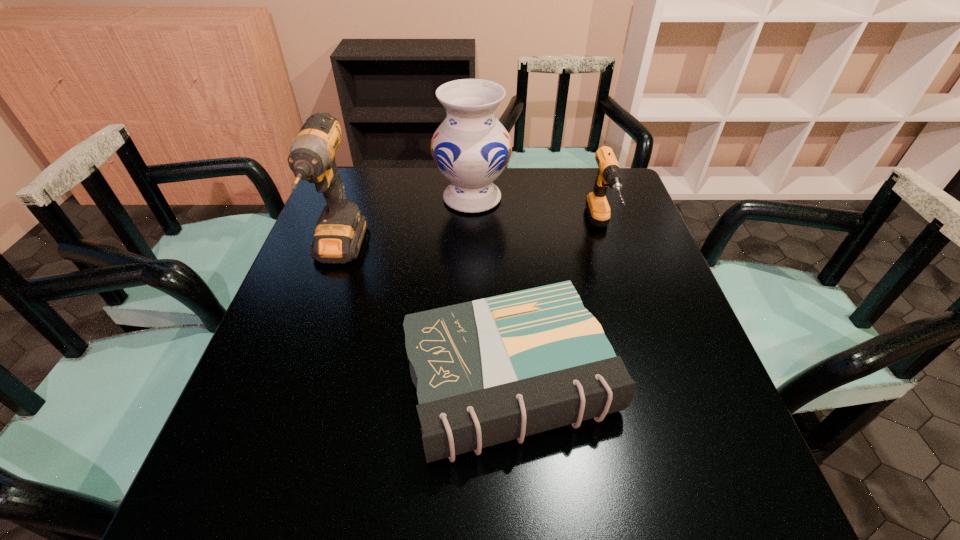
Locate an element on the screen. This screenshot has width=960, height=540. free spot at the right edge of the desktop is located at coordinates (703, 440).

Where is `vacant space at the far left corner of the desktop`? vacant space at the far left corner of the desktop is located at coordinates (372, 184).

Image resolution: width=960 pixels, height=540 pixels. Identify the location of vacant space at the near left corner of the desktop. (192, 505).

This screenshot has height=540, width=960. Find the location of `free point between the second shortest object and the taller drill`. free point between the second shortest object and the taller drill is located at coordinates (469, 241).

At what (x,y) coordinates should I click in order to perform the action: click on vacant area that lies between the vase and the taller drill. Please return your answer as a coordinate pair (x, y). Looking at the image, I should click on (405, 225).

What are the coordinates of `free spot between the leftmost object and the right drill` in the screenshot? It's located at (469, 241).

Image resolution: width=960 pixels, height=540 pixels. I want to click on free space between the shorter drill and the taller drill, so click(x=469, y=241).

Identify the location of free space between the taller drill and the rightmost object. Image resolution: width=960 pixels, height=540 pixels. (469, 241).

This screenshot has height=540, width=960. What are the coordinates of `empty location between the left drill and the vase` in the screenshot? It's located at (405, 225).

Identify the location of free space between the vase and the taller drill. (405, 225).